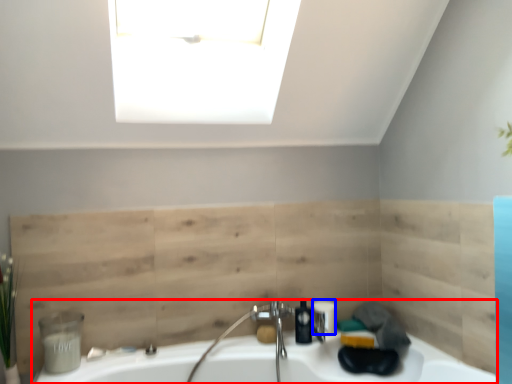
Question: Which object appears farthest to the camera in this image, sink (highlighted by a red box) or toiletry (highlighted by a blue box)?

Choices:
 (A) sink
 (B) toiletry

Answer: (B)